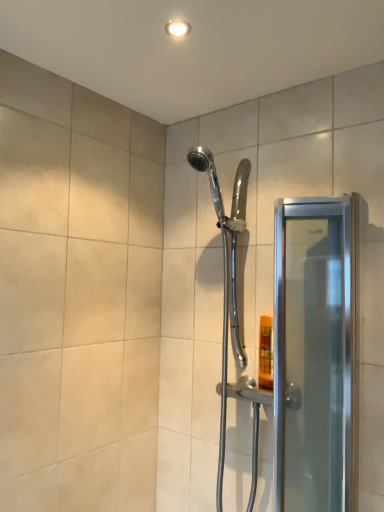
This screenshot has height=512, width=384. Describe the element at coordinates (315, 355) in the screenshot. I see `clear glass screen door at right` at that location.

At what (x,y) coordinates should I click in order to perform the action: click on clear glass screen door at right. Please return your answer as a coordinate pair (x, y). Looking at the image, I should click on pos(315,355).

Locate an element on the screen. clear glass screen door at right is located at coordinates (315, 355).